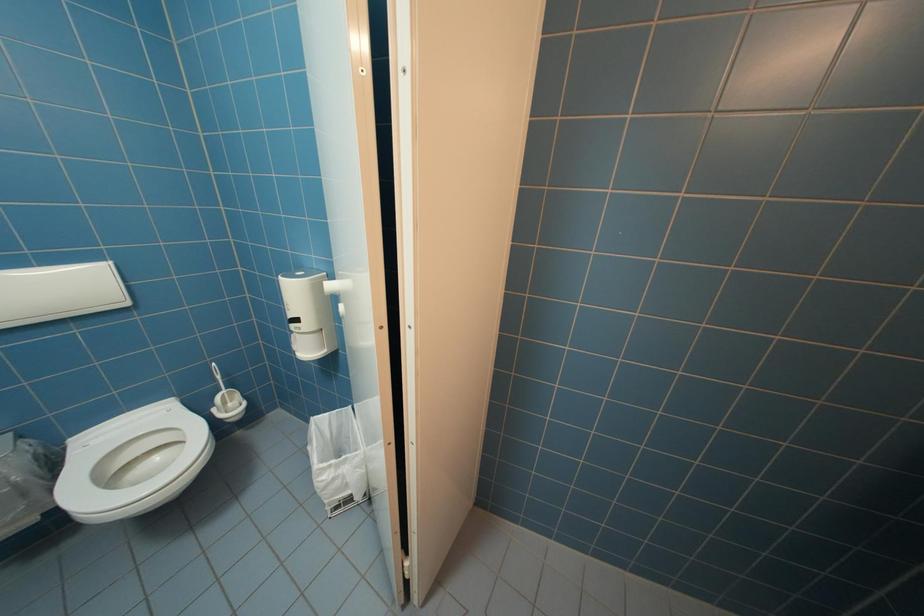
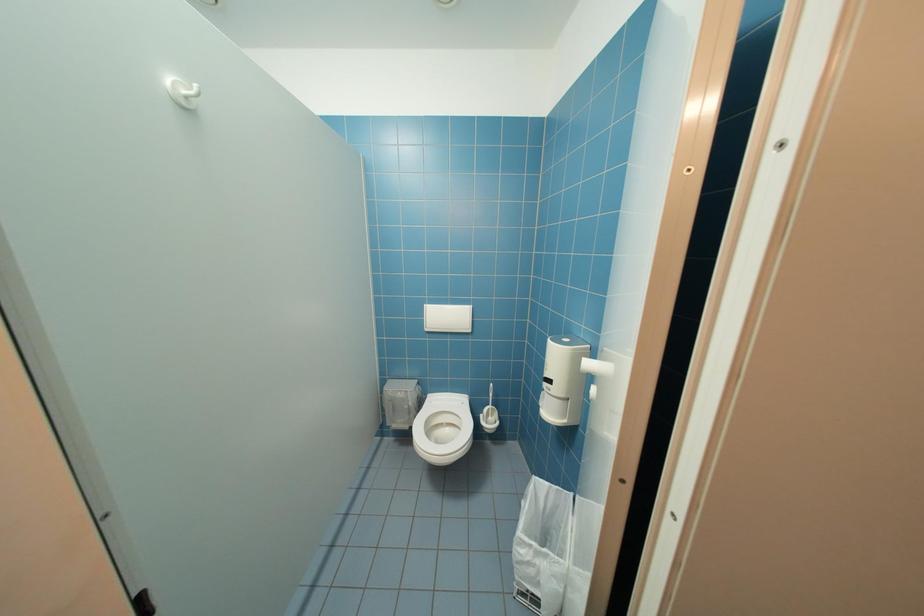
Question: Based on the continuous images, in which direction is the camera rotating? Reply with the corresponding letter.

Choices:
 (A) Left
 (B) Right
 (C) Up
 (D) Down

Answer: (A)